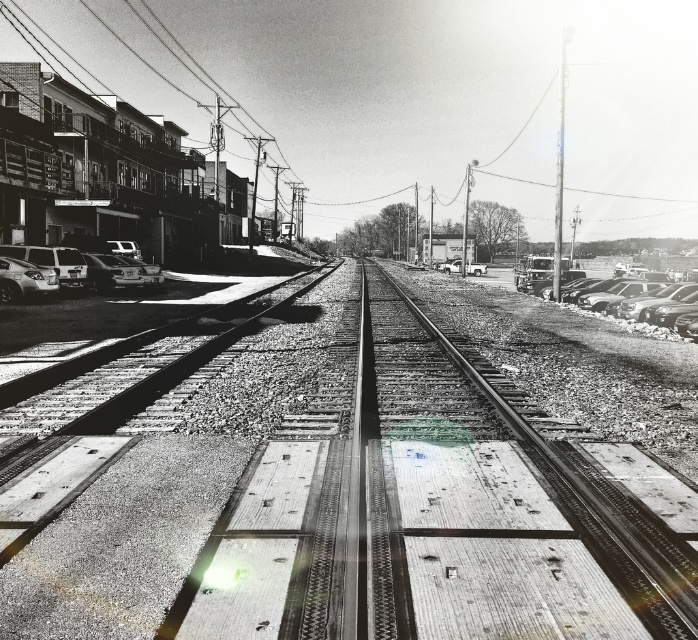
Does smooth concrete train track at center have a greater height compared to metallic silver car at center?

Correct, smooth concrete train track at center is much taller as metallic silver car at center.

In the scene shown: Is smooth concrete train track at center wider than metallic silver car at center?

In fact, smooth concrete train track at center might be narrower than metallic silver car at center.

Image resolution: width=698 pixels, height=640 pixels. I want to click on smooth concrete train track at center, so click(x=581, y=493).

Is metal/gravel railroad tracks at center smaller than shiny silver sedan at left?

Incorrect, metal/gravel railroad tracks at center is not smaller in size than shiny silver sedan at left.

This screenshot has height=640, width=698. Describe the element at coordinates (346, 499) in the screenshot. I see `metal/gravel railroad tracks at center` at that location.

Where is `metal/gravel railroad tracks at center`? The image size is (698, 640). metal/gravel railroad tracks at center is located at coordinates (346, 499).

What do you see at coordinates (581, 493) in the screenshot? The width and height of the screenshot is (698, 640). I see `smooth concrete train track at center` at bounding box center [581, 493].

Who is lower down, smooth concrete train track at center or shiny black sedan at right?

smooth concrete train track at center is below.

Is point (637, 570) farther from camera compared to point (623, 320)?

No.

The image size is (698, 640). What are the coordinates of `smooth concrete train track at center` in the screenshot? It's located at click(581, 493).